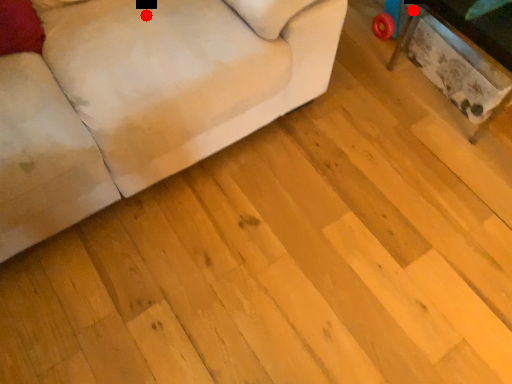
Question: Two points are circled on the image, labeled by A and B beside each circle. Which point appears farthest from the camera in this image?

Choices:
 (A) A is further
 (B) B is further

Answer: (A)